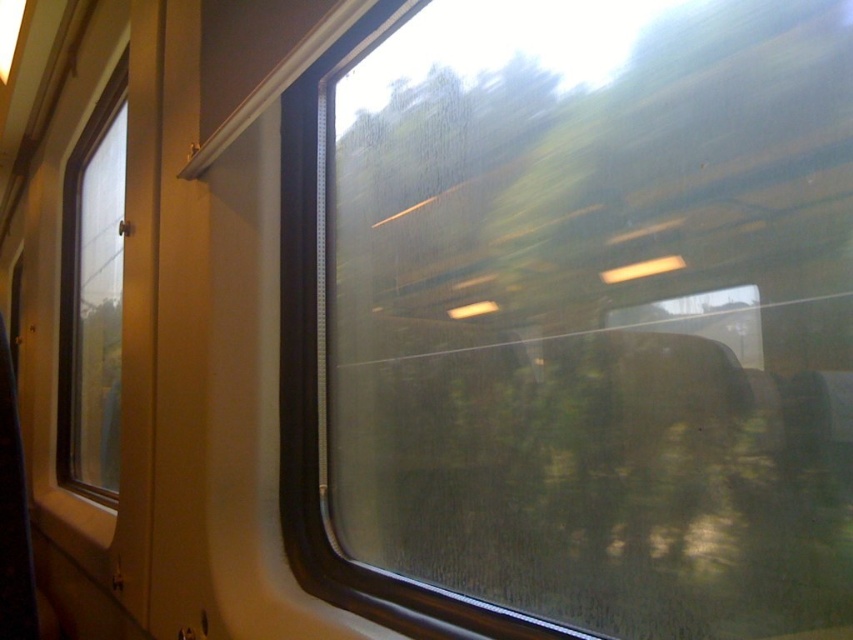
Question: Is transparent glass train window at center above transparent glass window at left?

Choices:
 (A) no
 (B) yes

Answer: (A)

Question: Among these points, which one is nearest to the camera?

Choices:
 (A) (815, 493)
 (B) (94, 106)

Answer: (A)

Question: Which point is farther from the camera taking this photo?

Choices:
 (A) (489, 205)
 (B) (106, 273)

Answer: (B)

Question: Among these objects, which one is farthest from the camera?

Choices:
 (A) transparent glass window at left
 (B) transparent glass train window at center

Answer: (A)

Question: Can you confirm if transparent glass train window at center is wider than transparent glass window at left?

Choices:
 (A) no
 (B) yes

Answer: (A)

Question: Can you confirm if transparent glass train window at center is thinner than transparent glass window at left?

Choices:
 (A) yes
 (B) no

Answer: (A)